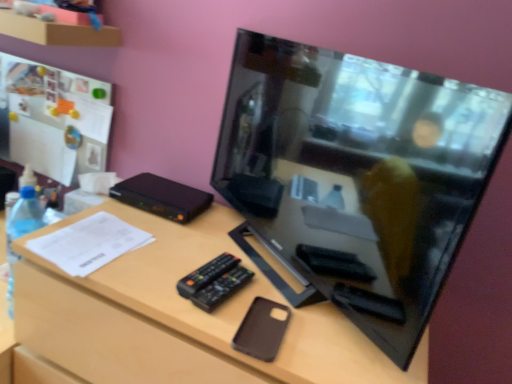
Locate an element on the screen. This screenshot has height=384, width=512. free region on the left part of black plastic remote at center is located at coordinates (155, 269).